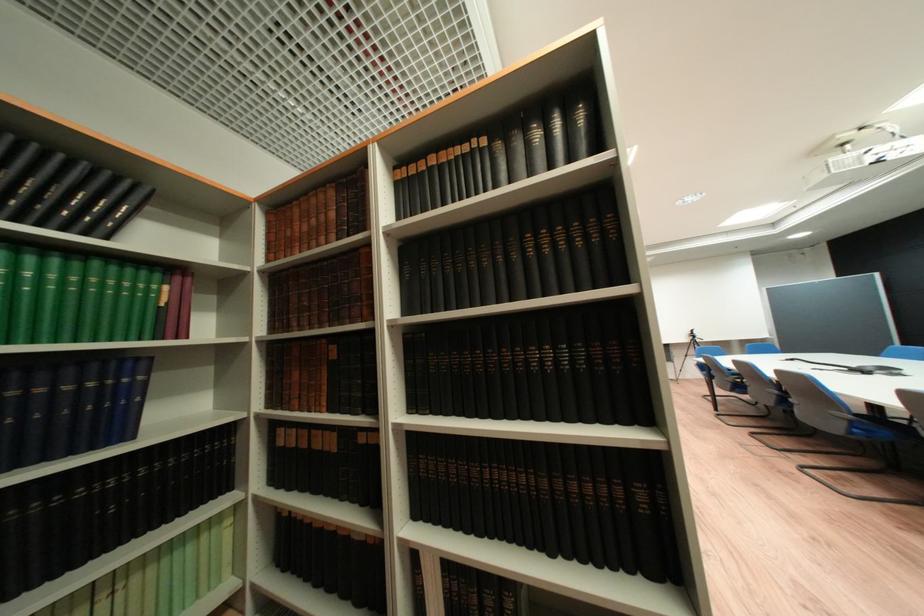
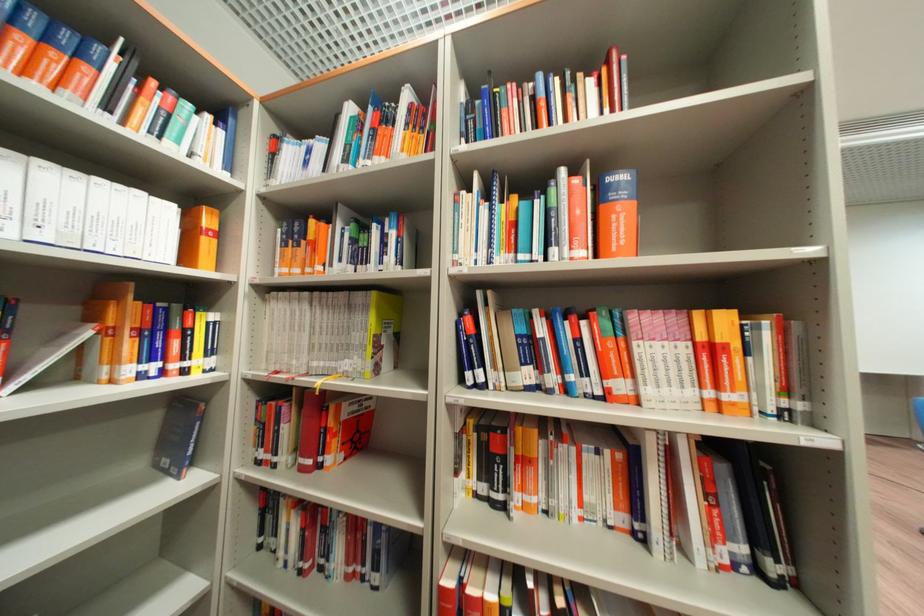
Question: The images are taken continuously from a first-person perspective. In which direction are you moving?

Choices:
 (A) Left
 (B) Right
 (C) Forward
 (D) Backward

Answer: (C)